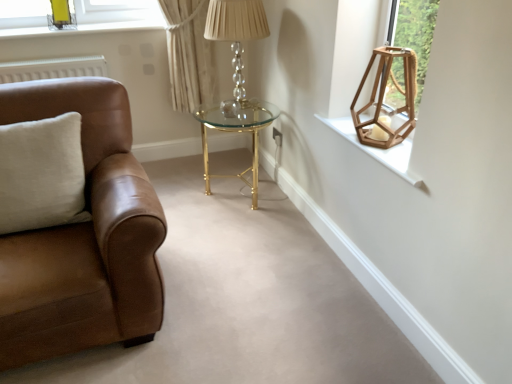
Identify the location of free spot to the right of metallic gold lamp at upper left, which ranks as the 1th lamp in left-to-right order. (88, 26).